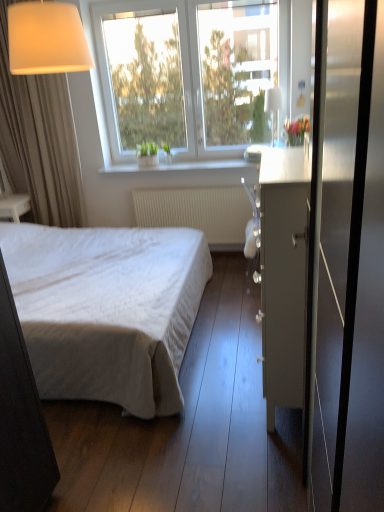
Question: Can you confirm if matte gray cabinet at center-right is thinner than transparent glass window at upper center?

Choices:
 (A) no
 (B) yes

Answer: (A)

Question: Can you confirm if matte gray cabinet at center-right is smaller than transparent glass window at upper center?

Choices:
 (A) yes
 (B) no

Answer: (A)

Question: Is matte gray cabinet at center-right not close to transparent glass window at upper center?

Choices:
 (A) yes
 (B) no

Answer: (A)

Question: Can you confirm if matte gray cabinet at center-right is wider than transparent glass window at upper center?

Choices:
 (A) no
 (B) yes

Answer: (B)

Question: Is the surface of matte gray cabinet at center-right in direct contact with transparent glass window at upper center?

Choices:
 (A) no
 (B) yes

Answer: (A)

Question: Choose the correct answer: Is white quilted fabric bed at center inside transparent glass lamp at upper center, placed as the second lamp when sorted from front to back, or outside it?

Choices:
 (A) inside
 (B) outside

Answer: (B)

Question: Looking at their shapes, would you say white quilted fabric bed at center is wider or thinner than transparent glass lamp at upper center, the second lamp viewed from the left?

Choices:
 (A) thin
 (B) wide

Answer: (B)

Question: Does point (69, 318) appear closer or farther from the camera than point (271, 123)?

Choices:
 (A) farther
 (B) closer

Answer: (B)

Question: Relative to transparent glass lamp at upper center, which ranks as the first lamp in back-to-front order, is white quilted fabric bed at center in front or behind?

Choices:
 (A) behind
 (B) front

Answer: (B)

Question: Considering the positions of metallic glass screen door at right and matte gray cabinet at center-right in the image, is metallic glass screen door at right wider or thinner than matte gray cabinet at center-right?

Choices:
 (A) wide
 (B) thin

Answer: (B)

Question: From the image's perspective, relative to matte gray cabinet at center-right, is metallic glass screen door at right above or below?

Choices:
 (A) above
 (B) below

Answer: (B)

Question: Considering the positions of point (319, 39) and point (296, 179), is point (319, 39) closer or farther from the camera than point (296, 179)?

Choices:
 (A) farther
 (B) closer

Answer: (B)

Question: From a real-world perspective, is metallic glass screen door at right physically located above or below matte gray cabinet at center-right?

Choices:
 (A) below
 (B) above

Answer: (B)

Question: Considering the positions of point (382, 16) and point (59, 12), is point (382, 16) closer or farther from the camera than point (59, 12)?

Choices:
 (A) closer
 (B) farther

Answer: (A)

Question: Based on their sizes in the image, would you say metallic glass screen door at right is bigger or smaller than matte white lampshade at upper left, acting as the 1th lamp starting from the front?

Choices:
 (A) big
 (B) small

Answer: (A)